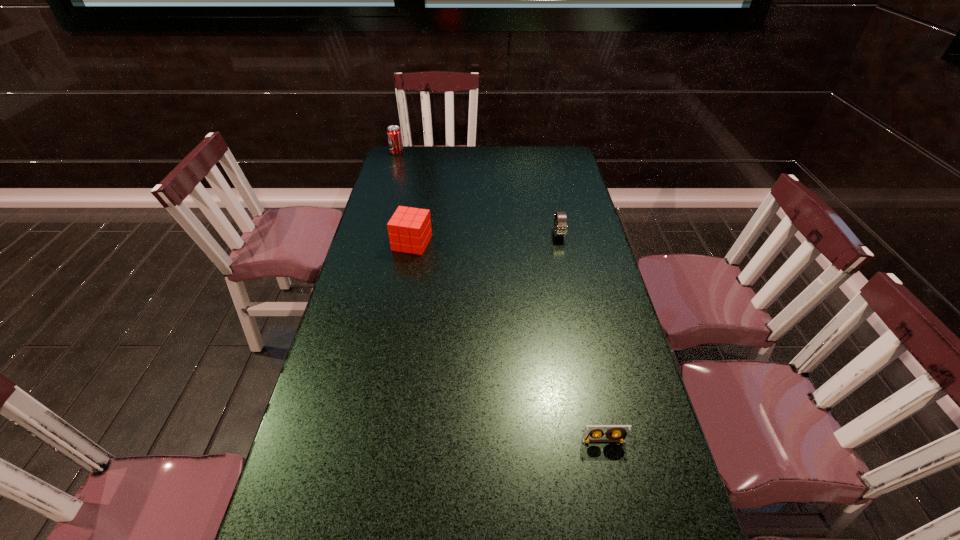
I want to click on vacant point located between the farthest object and the watch, so click(x=478, y=193).

Find the location of `unoccupied position between the soda and the watch`. unoccupied position between the soda and the watch is located at coordinates (478, 193).

I want to click on vacant point located between the nearest object and the soda, so click(500, 296).

This screenshot has height=540, width=960. I want to click on vacant space that is in between the second object from left to right and the leftmost object, so click(x=404, y=198).

Find the location of a particular element. The width and height of the screenshot is (960, 540). unoccupied area between the shortest object and the second shortest object is located at coordinates (581, 338).

Locate an element on the screen. Image resolution: width=960 pixels, height=540 pixels. unoccupied area between the second object from left to right and the shortest object is located at coordinates (508, 342).

The image size is (960, 540). What are the coordinates of `vacant region between the videotape and the cube` in the screenshot? It's located at (508, 342).

Find the location of `free space between the farthest object and the cube`. free space between the farthest object and the cube is located at coordinates 404,198.

Find the location of a particular element. This screenshot has width=960, height=540. unoccupied area between the videotape and the leftmost object is located at coordinates pos(500,296).

Locate an element on the screen. The image size is (960, 540). vacant space that is in between the farthest object and the nearest object is located at coordinates (500, 296).